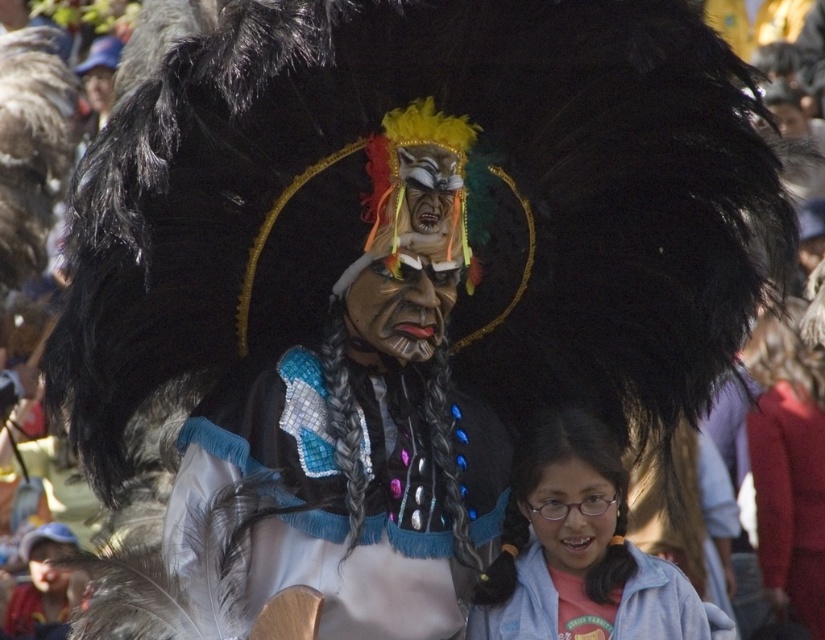
Question: Which of the following is the farthest from the observer?

Choices:
 (A) (269, 529)
 (B) (521, 499)
 (C) (753, 368)

Answer: (C)

Question: Does shiny silver feathers at center have a smaller size compared to matte red jacket at lower right?

Choices:
 (A) yes
 (B) no

Answer: (B)

Question: Does matte red jacket at lower right appear over pink fabric at lower center?

Choices:
 (A) yes
 (B) no

Answer: (A)

Question: Which is nearer to the pink fabric at lower right?

Choices:
 (A) shiny silver feathers at center
 (B) pink fabric at lower center
 (C) matte red jacket at lower right

Answer: (B)

Question: Which point appears closest to the camera in this image?

Choices:
 (A) (668, 568)
 (B) (590, 452)
 (C) (808, 468)
 (D) (232, 406)

Answer: (D)

Question: Can you confirm if shiny silver feathers at center is smaller than pink fabric at lower center?

Choices:
 (A) no
 (B) yes

Answer: (A)